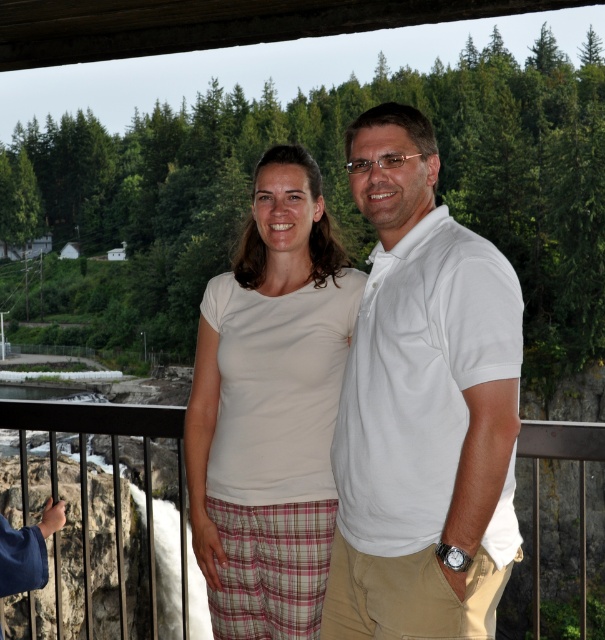
Question: Does white cotton polo shirt at center appear on the left side of black metal railing at center?

Choices:
 (A) no
 (B) yes

Answer: (B)

Question: Which point is closer to the camera taking this photo?

Choices:
 (A) (321, 595)
 (B) (489, 529)

Answer: (B)

Question: Is white cotton polo shirt at center wider than white cotton shirt at center?

Choices:
 (A) yes
 (B) no

Answer: (B)

Question: Which point is farther from the camera taking this photo?

Choices:
 (A) [x=145, y=438]
 (B) [x=517, y=376]
 (C) [x=253, y=333]

Answer: (A)

Question: Considering the relative positions of white cotton polo shirt at center and white cotton shirt at center in the image provided, where is white cotton polo shirt at center located with respect to white cotton shirt at center?

Choices:
 (A) right
 (B) left

Answer: (A)

Question: Estimate the real-world distances between objects in this image. Which object is closer to the white cotton shirt at center?

Choices:
 (A) black metal railing at center
 (B) white cotton polo shirt at center

Answer: (B)